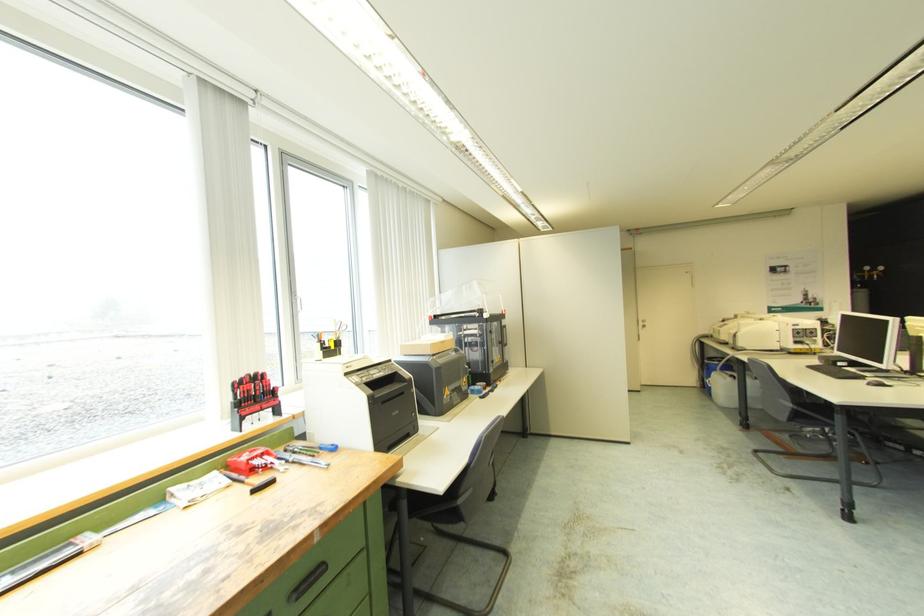
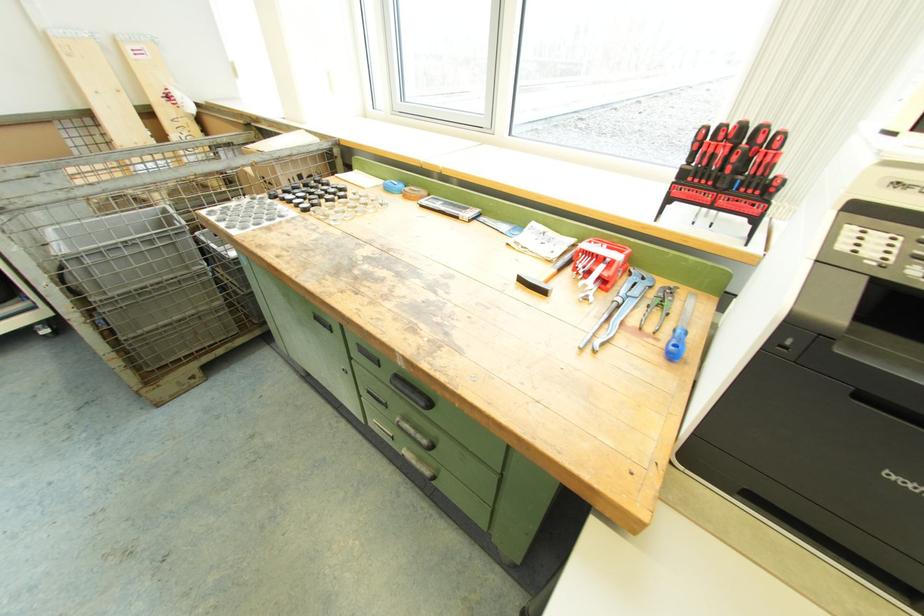
Find the pixel in the second image that matches (x=248, y=458) in the first image.

(588, 246)